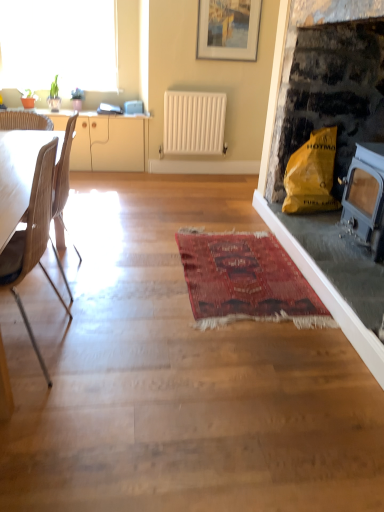
Question: Considering the relative positions of white matte radiator at center and transparent glass window at upper left in the image provided, is white matte radiator at center to the left or to the right of transparent glass window at upper left?

Choices:
 (A) right
 (B) left

Answer: (A)

Question: Considering the positions of white matte radiator at center and transparent glass window at upper left in the image, is white matte radiator at center bigger or smaller than transparent glass window at upper left?

Choices:
 (A) big
 (B) small

Answer: (B)

Question: Based on their relative distances, which object is farther from the light brown wood chair at left, which appears as the second chair when viewed from the front?

Choices:
 (A) matte white picture frame at upper center
 (B) transparent glass window at upper left
 (C) red woven rug at center
 (D) wooden chair at left, which is the 2th chair from back to front
 (E) yellow paper bag at right

Answer: (B)

Question: Based on their relative distances, which object is nearer to the red woven rug at center?

Choices:
 (A) wooden chair at left, which is the 2th chair from back to front
 (B) yellow paper bag at right
 (C) light brown wood chair at left, which appears as the second chair when viewed from the front
 (D) beige wood cabinet at left
 (E) matte white picture frame at upper center

Answer: (B)